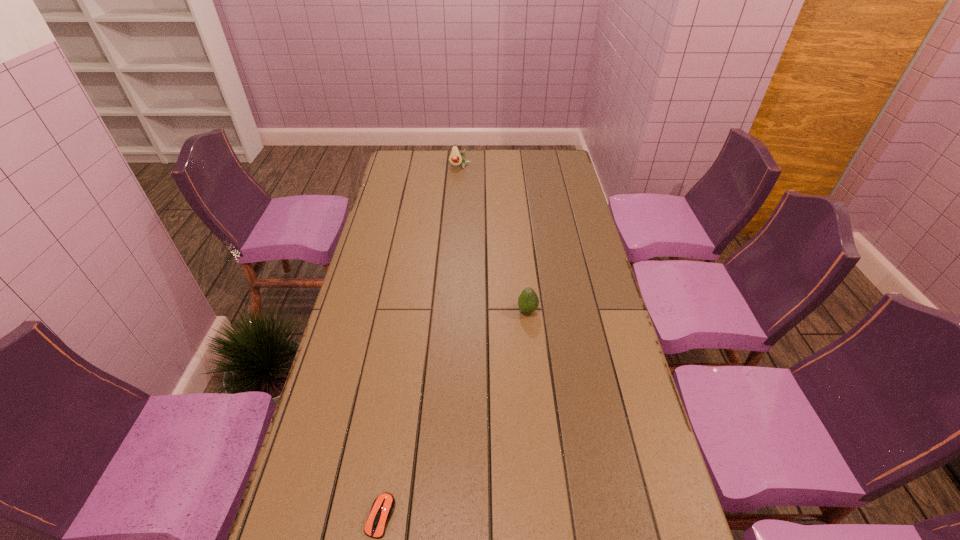
At what (x,y) coordinates should I click in order to perform the action: click on the left avocado. Please return your answer as a coordinate pair (x, y). The image size is (960, 540). Looking at the image, I should click on (455, 158).

This screenshot has height=540, width=960. What are the coordinates of `the second object from right to left` in the screenshot? It's located at (455, 158).

Find the location of a particular element. This screenshot has width=960, height=540. the right avocado is located at coordinates (528, 301).

Identify the location of the second farthest object. This screenshot has width=960, height=540. (528, 301).

Locate an element on the screen. the leftmost object is located at coordinates (383, 506).

Where is `the nearest object`? the nearest object is located at coordinates (383, 506).

In order to click on vacant point located on the seed side of the farther avocado in this screenshot , I will do `click(456, 219)`.

This screenshot has width=960, height=540. I want to click on vacant space situated on the right of the rightmost object, so click(563, 311).

Image resolution: width=960 pixels, height=540 pixels. In order to click on vacant space located 0.170m on the back of the nearest object in this screenshot , I will do `click(395, 426)`.

Image resolution: width=960 pixels, height=540 pixels. What are the coordinates of `object that is at the far edge` in the screenshot? It's located at (455, 158).